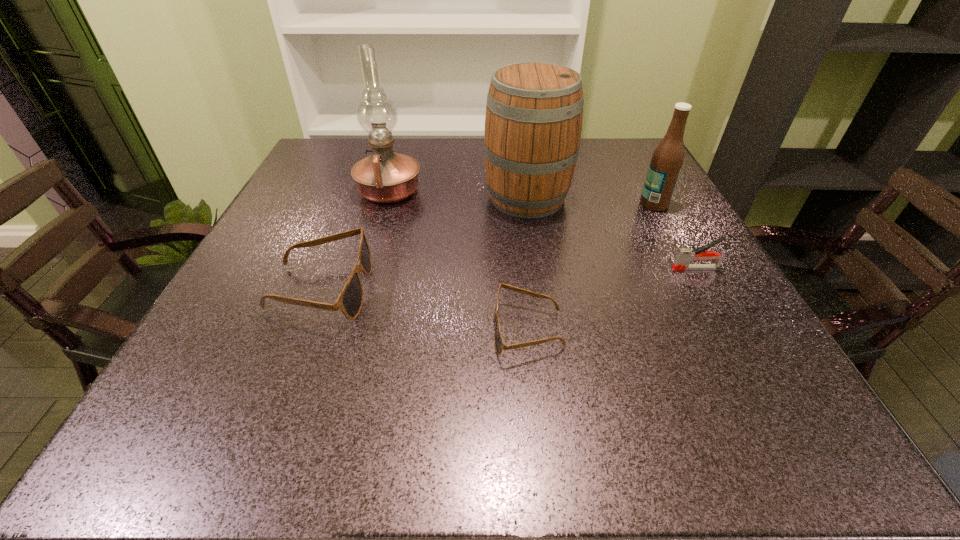
Image resolution: width=960 pixels, height=540 pixels. Find the location of `sunglasses at the left edge`. sunglasses at the left edge is located at coordinates click(350, 301).

Locate an element on the screen. oil lamp present at the left edge is located at coordinates (385, 176).

At what (x,y) coordinates should I click in order to perform the action: click on beer bottle positioned at the right edge. Please return your answer as a coordinate pair (x, y). The height and width of the screenshot is (540, 960). Looking at the image, I should click on (667, 159).

Where is `stapler situated at the right edge`? The width and height of the screenshot is (960, 540). stapler situated at the right edge is located at coordinates (684, 256).

The image size is (960, 540). In order to click on object that is positioned at the far left corner in this screenshot , I will do `click(385, 176)`.

In the image, there is a desktop. Where is `free region at the far edge`? This screenshot has width=960, height=540. free region at the far edge is located at coordinates (433, 148).

Locate an element on the screen. The width and height of the screenshot is (960, 540). free space at the near edge is located at coordinates (293, 352).

Where is `free space at the left edge of the desktop`? The width and height of the screenshot is (960, 540). free space at the left edge of the desktop is located at coordinates (331, 193).

You are a GUI agent. You are given a task and a screenshot of the screen. Output one action in this format:
    pyautogui.click(x=<x>, y=<y>)
    Task: Click on the vacant space at the right edge of the desktop
    The image size is (960, 540).
    Given the screenshot: What is the action you would take?
    pyautogui.click(x=668, y=212)

The image size is (960, 540). In order to click on vacant space at the far right corner in this screenshot , I will do `click(588, 142)`.